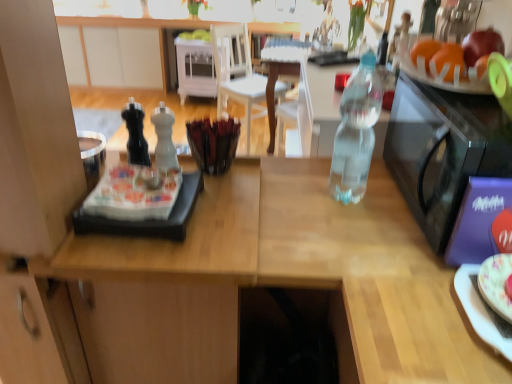
You are a GUI agent. You are given a task and a screenshot of the screen. Output one action in this format:
    pyautogui.click(x=<x>, y=<y>)
    Task: Click on the free point to the right of clear plastic bottle at center, which ranks as the 3th bottle in left-to-right order
    The width and height of the screenshot is (512, 384).
    Given the screenshot: What is the action you would take?
    pyautogui.click(x=390, y=189)